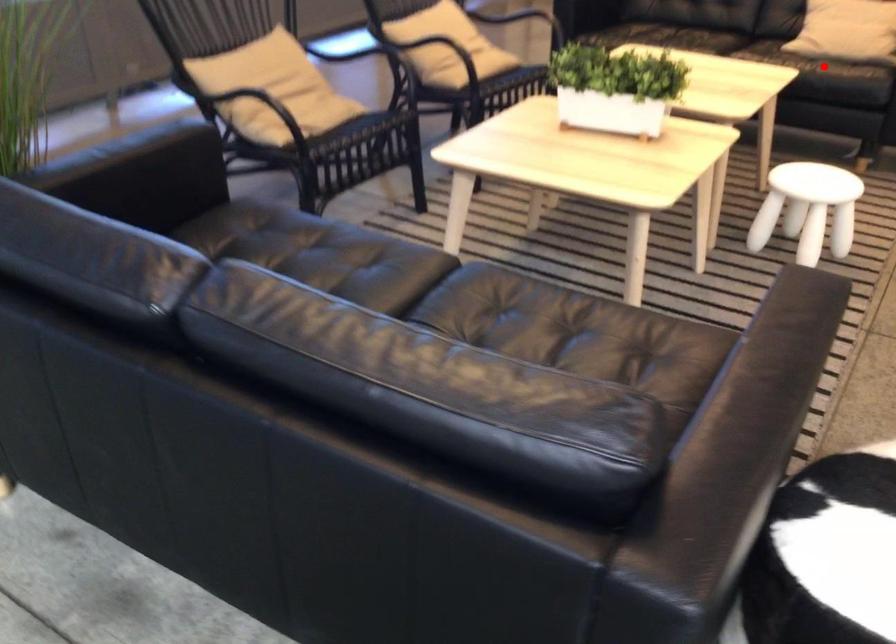
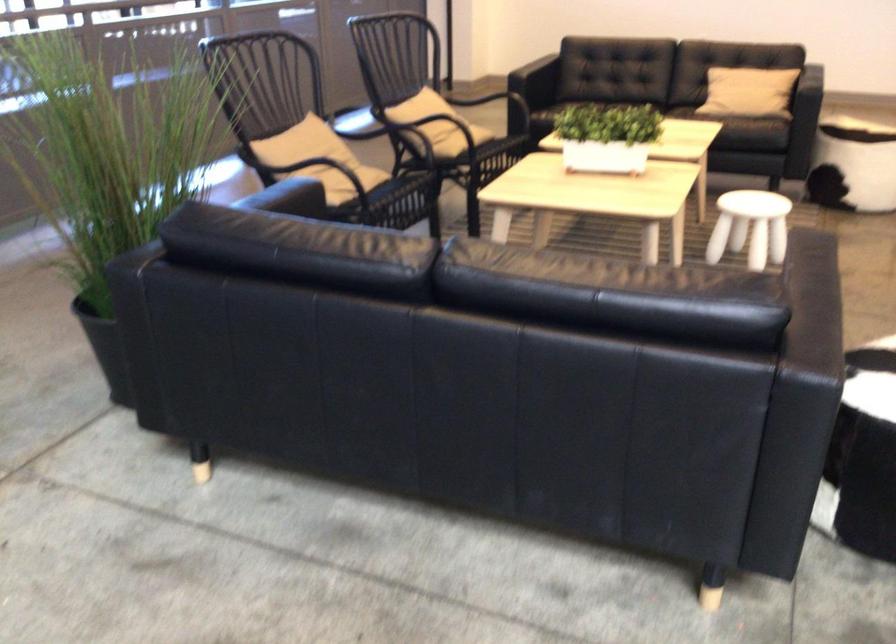
Question: I am providing you with two images of the same scene from different viewpoints. Image1 has a red point marked. In image2, the corresponding 3D location appears at what relative position? Reply with the corresponding letter.

Choices:
 (A) Closer
 (B) Farther

Answer: (B)